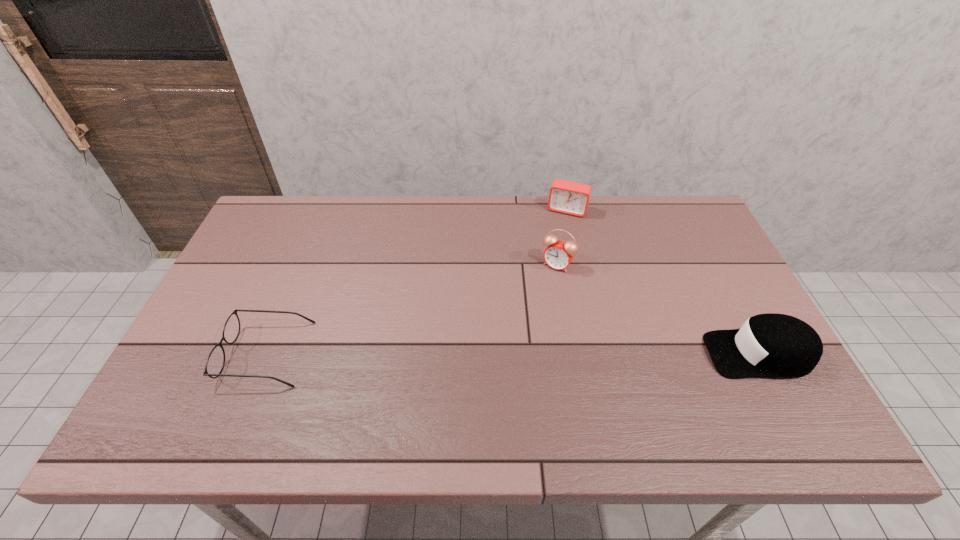
At what (x,y) coordinates should I click in order to perform the action: click on vacant spot on the desktop that is between the spectacles and the rightmost object and is positioned on the clock face of the tallest object. Please return your answer as a coordinate pair (x, y). This screenshot has height=540, width=960. Looking at the image, I should click on (500, 354).

Locate an element on the screen. free space on the desktop that is between the spectacles and the cap and is positioned on the front-facing side of the shorter alarm clock is located at coordinates (516, 354).